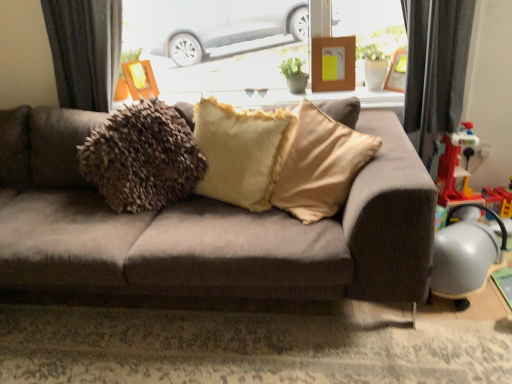
Question: From the image's perspective, relative to metallic gray armchair at lower right, is wooden frame at upper center, which is counted as the 1th picture frame, starting from the left, above or below?

Choices:
 (A) below
 (B) above

Answer: (B)

Question: In terms of width, does wooden frame at upper center, which is counted as the 1th picture frame, starting from the left, look wider or thinner when compared to metallic gray armchair at lower right?

Choices:
 (A) wide
 (B) thin

Answer: (B)

Question: Based on their relative distances, which object is farther from the wooden frame at upper center, which is counted as the 1th picture frame, starting from the left?

Choices:
 (A) metallic gray armchair at lower right
 (B) wooden picture frame at upper center, which is the 2th picture frame in left-to-right order
 (C) wooden frame at upper right, arranged as the 1th picture frame when viewed from the right
 (D) transparent glass window at upper center
 (E) metallic silver toy at right

Answer: (A)

Question: Which object is the closest to the wooden picture frame at upper center, marked as the second picture frame in a right-to-left arrangement?

Choices:
 (A) fuzzy beige pillow at center
 (B) wooden frame at upper right, arranged as the 1th picture frame when viewed from the right
 (C) suede-like brown couch at center
 (D) white glossy window sill at upper center
 (E) wooden frame at upper center, which is counted as the 1th picture frame, starting from the left

Answer: (D)